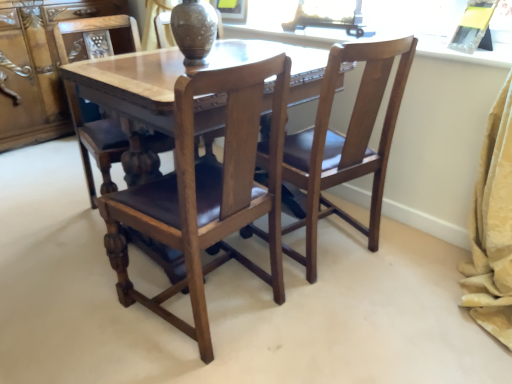
Locate an element on the screen. free space in front of brown matte vase at center is located at coordinates (169, 66).